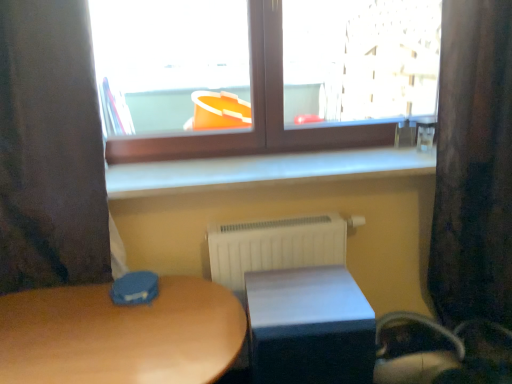
Question: Choose the correct answer: Is white smooth window sill at center inside matte wooden table at center, the second table positioned from the right, or outside it?

Choices:
 (A) inside
 (B) outside

Answer: (B)

Question: In terms of size, does white smooth window sill at center appear bigger or smaller than matte wooden table at center, the second table positioned from the right?

Choices:
 (A) big
 (B) small

Answer: (B)

Question: Estimate the real-world distances between objects in this image. Which object is closer to the white smooth window sill at center?

Choices:
 (A) white plastic radiator at center
 (B) dark fabric curtain at left, placed as the 1th curtain when sorted from left to right
 (C) white matte table at lower center, acting as the 2th table starting from the left
 (D) matte wooden table at center, arranged as the 1th table when viewed from the left
 (E) velvet dark brown curtain at right, placed as the 1th curtain when sorted from right to left

Answer: (A)

Question: Which object is positioned farthest from the dark fabric curtain at left, placed as the 1th curtain when sorted from left to right?

Choices:
 (A) brown wooden window at upper center
 (B) white smooth window sill at center
 (C) velvet dark brown curtain at right, the 2th curtain viewed from the left
 (D) matte wooden table at center, the second table positioned from the right
 (E) white matte table at lower center, placed as the 1th table when sorted from right to left

Answer: (C)